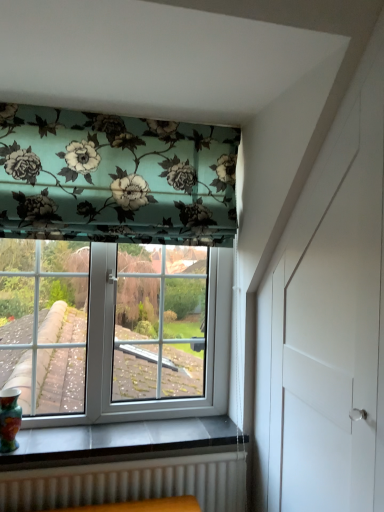
The width and height of the screenshot is (384, 512). I want to click on multicolored glossy vase at lower left, so click(x=9, y=419).

What do you see at coordinates (9, 419) in the screenshot? I see `multicolored glossy vase at lower left` at bounding box center [9, 419].

Where is `multicolored glossy vase at lower left`? Image resolution: width=384 pixels, height=512 pixels. multicolored glossy vase at lower left is located at coordinates (9, 419).